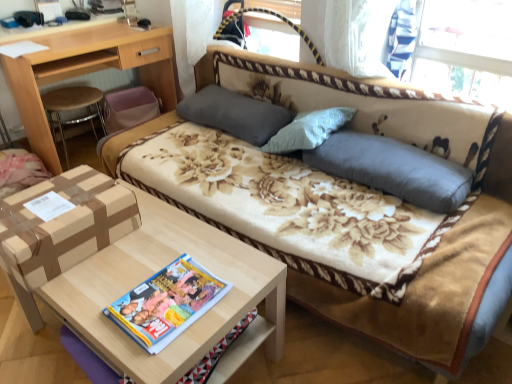
Question: Can you confirm if multicolored glossy magazine at center is shorter than gray fabric pillow at center, marked as the 2th pillow in a right-to-left arrangement?

Choices:
 (A) yes
 (B) no

Answer: (A)

Question: Is multicolored glossy magazine at center bigger than gray fabric pillow at center, which appears as the second pillow when viewed from the front?

Choices:
 (A) no
 (B) yes

Answer: (A)

Question: Is multicolored glossy magazine at center smaller than gray fabric pillow at center, which appears as the second pillow when viewed from the front?

Choices:
 (A) yes
 (B) no

Answer: (A)

Question: Considering the relative sizes of multicolored glossy magazine at center and gray fabric pillow at center, the first pillow viewed from the left, in the image provided, is multicolored glossy magazine at center wider than gray fabric pillow at center, the first pillow viewed from the left,?

Choices:
 (A) no
 (B) yes

Answer: (B)

Question: Could you tell me if multicolored glossy magazine at center is facing gray fabric pillow at center, marked as the 2th pillow in a right-to-left arrangement?

Choices:
 (A) no
 (B) yes

Answer: (A)

Question: Is multicolored glossy magazine at center taller than gray fabric pillow at center, which appears as the first pillow when viewed from the back?

Choices:
 (A) no
 (B) yes

Answer: (A)

Question: Can we say gray fabric pillow at center, acting as the 1th pillow starting from the front, lies outside floral fabric studio couch at center?

Choices:
 (A) yes
 (B) no

Answer: (B)

Question: Does gray fabric pillow at center, the second pillow positioned from the back, have a greater width compared to floral fabric studio couch at center?

Choices:
 (A) no
 (B) yes

Answer: (A)

Question: Does gray fabric pillow at center, marked as the first pillow in a right-to-left arrangement, have a lesser width compared to floral fabric studio couch at center?

Choices:
 (A) no
 (B) yes

Answer: (B)

Question: Is gray fabric pillow at center, acting as the 1th pillow starting from the front, at the left side of floral fabric studio couch at center?

Choices:
 (A) no
 (B) yes

Answer: (A)

Question: Is gray fabric pillow at center, the second pillow in the left-to-right sequence, shorter than floral fabric studio couch at center?

Choices:
 (A) no
 (B) yes

Answer: (B)

Question: Is gray fabric pillow at center, marked as the first pillow in a right-to-left arrangement, taller than floral fabric studio couch at center?

Choices:
 (A) no
 (B) yes

Answer: (A)

Question: From the image's perspective, is brown cardboard box at lower left under floral fabric studio couch at center?

Choices:
 (A) no
 (B) yes

Answer: (B)